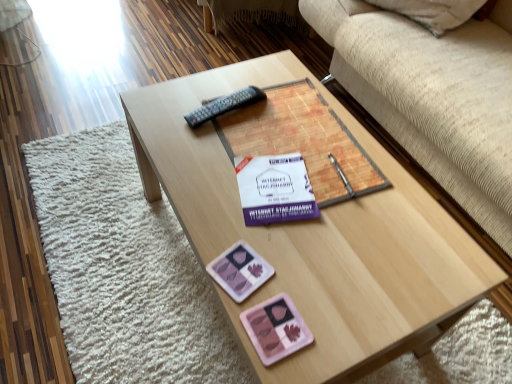
Find the location of a particular element. This screenshot has width=512, height=384. free location to the right of pink matte palette at center, which is the first currency from bottom to top is located at coordinates (355, 314).